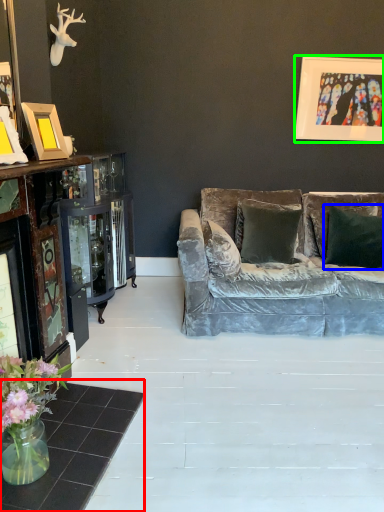
Question: Considering the real-world distances, which object is closest to table (highlighted by a red box)? pillow (highlighted by a blue box) or picture frame (highlighted by a green box).

Choices:
 (A) pillow
 (B) picture frame

Answer: (A)